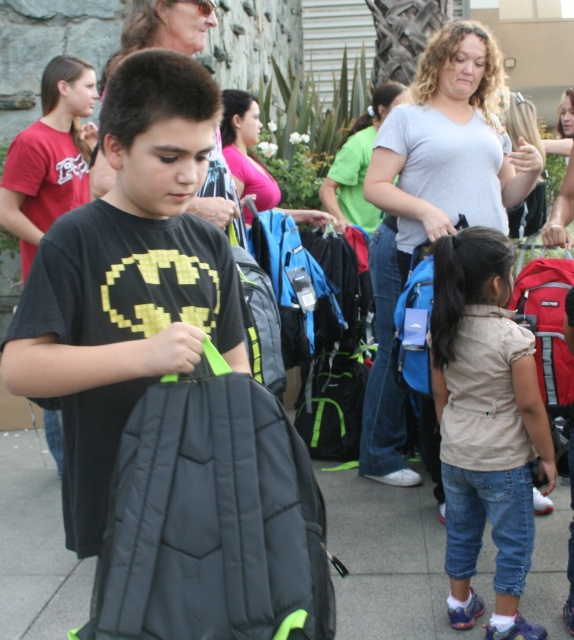
Which is more to the left, gray fabric backpack at lower center or matte pink shirt at center?

matte pink shirt at center

Is gray fabric backpack at lower center further to camera compared to matte pink shirt at center?

That is False.

Identify the location of gray fabric backpack at lower center. (393, 560).

Is matte black hair at upper center smaller than red fabric backpack at lower right?

Incorrect, matte black hair at upper center is not smaller in size than red fabric backpack at lower right.

Which is behind, point (215, 156) or point (544, 288)?

The point (544, 288) is more distant.

I want to click on matte black hair at upper center, so click(164, 28).

Consider the image. Which is more to the right, black quilted backpack at center or gray cotton shirt at upper center?

Positioned to the right is gray cotton shirt at upper center.

Does point (150, 508) lie behind point (530, 150)?

No, (150, 508) is closer to viewer.

At what (x,y) coordinates should I click in order to perform the action: click on black quilted backpack at center. Please return your answer as a coordinate pair (x, y). The width and height of the screenshot is (574, 640). Looking at the image, I should click on (212, 518).